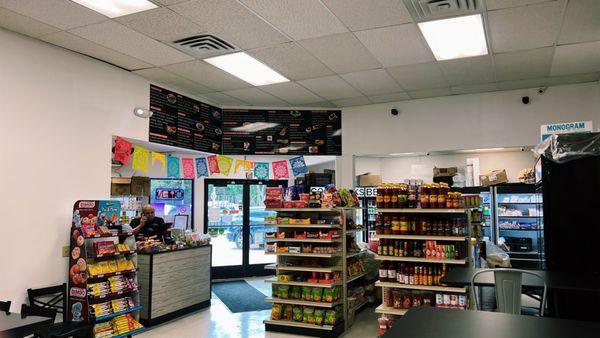
Find the location of a particular element. security cameras is located at coordinates (526, 98), (397, 114).